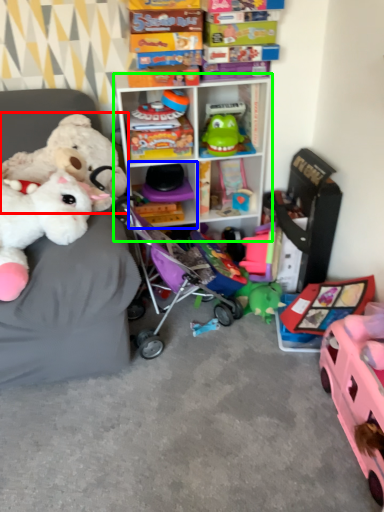
Question: Considering the real-world distances, which object is closest to toy (highlighted by a red box)? shelf (highlighted by a blue box) or shelf (highlighted by a green box).

Choices:
 (A) shelf
 (B) shelf

Answer: (B)